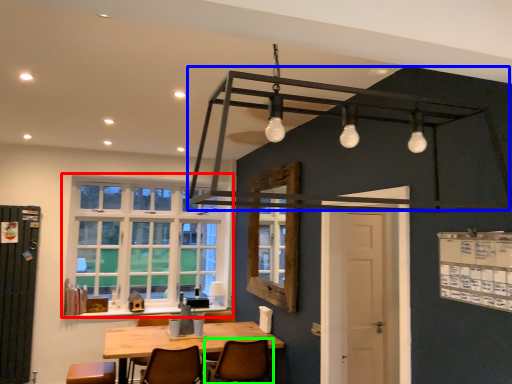
Question: Based on their relative distances, which object is farther from window (highlighted by a red box)? Choose from bunk bed (highlighted by a blue box) and chair (highlighted by a green box).

Choices:
 (A) bunk bed
 (B) chair

Answer: (A)